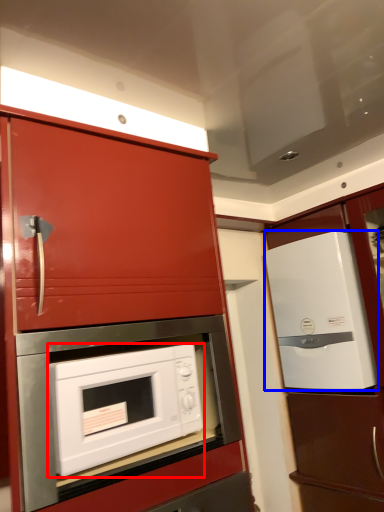
Question: Among these objects, which one is nearest to the camera, microwave oven (highlighted by a red box) or refrigerator (highlighted by a blue box)?

Choices:
 (A) microwave oven
 (B) refrigerator

Answer: (A)